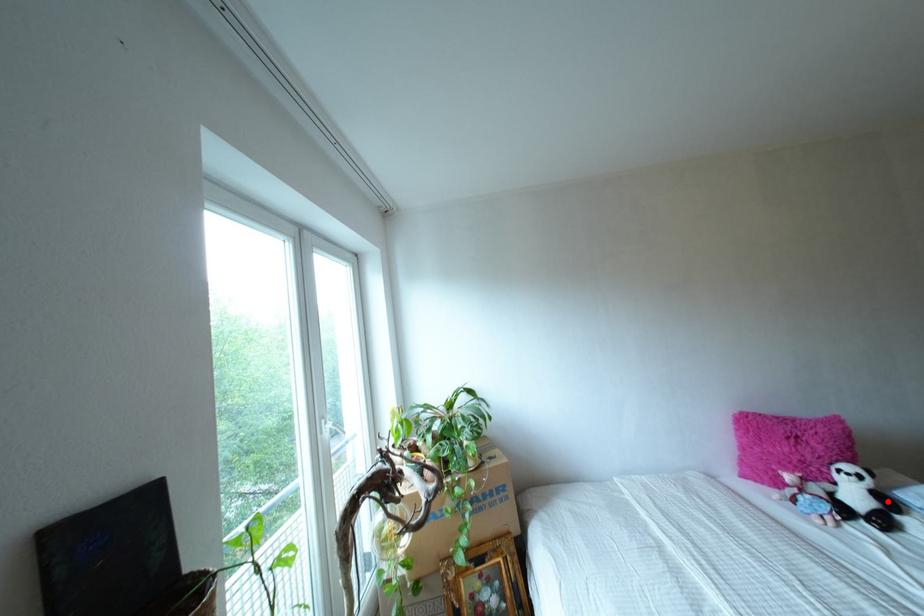
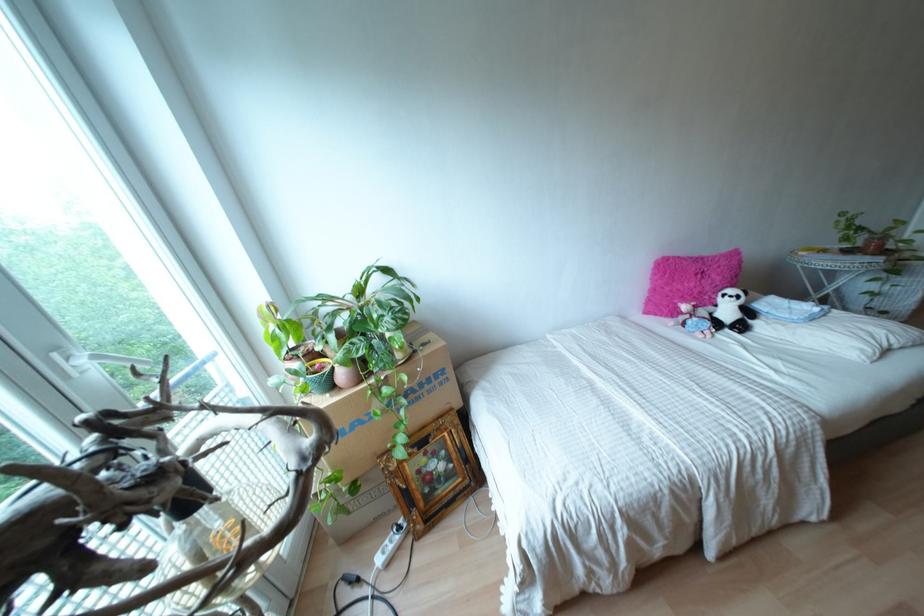
Locate, in the second image, the point that corresponds to the highlighted location in the first image.

(747, 312)